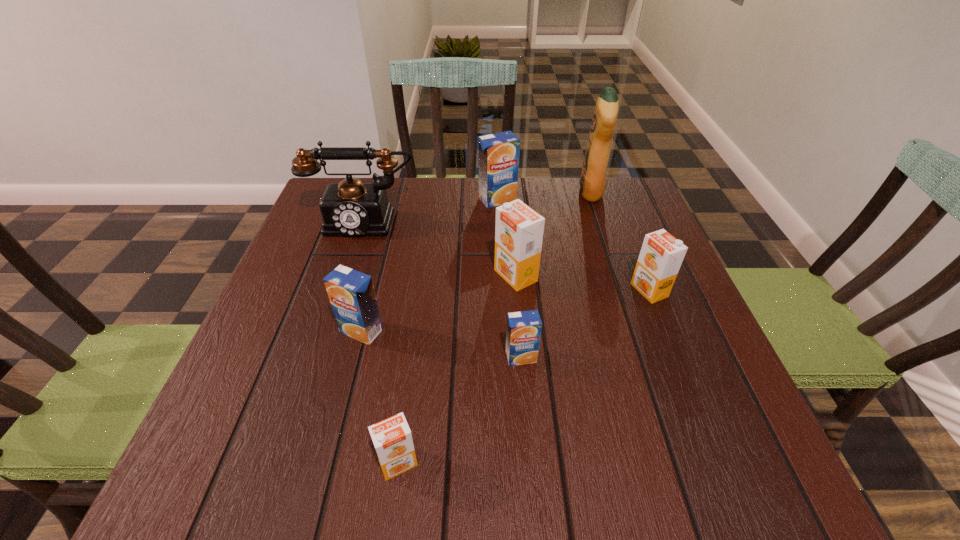
Identify the location of free location that satisfies the following two spatial constraints: 1. on the front of the rightmost orange orange juice at the rotary dial; 2. on the right side of the gray telephone. Image resolution: width=960 pixels, height=540 pixels. (341, 291).